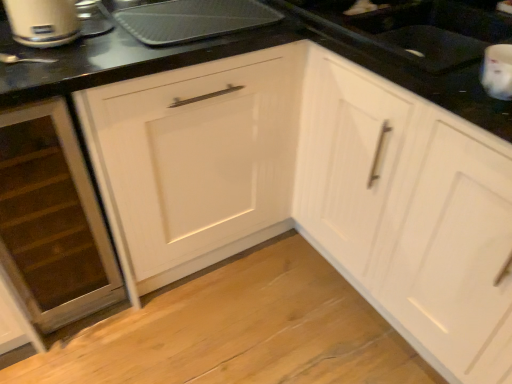
This screenshot has width=512, height=384. What do you see at coordinates (42, 22) in the screenshot?
I see `matte silver toaster at upper left` at bounding box center [42, 22].

Where is `white glossy sink at upper right`? white glossy sink at upper right is located at coordinates (415, 29).

Measure the distance between white glossy cabinet at center, the 2th cabinetry viewed from the left, and camera.

The depth of white glossy cabinet at center, the 2th cabinetry viewed from the left, is 33.98 inches.

Locate an element on the screen. This screenshot has width=512, height=384. white glossy cabinet at center, which appears as the first cabinetry when viewed from the right is located at coordinates (410, 214).

In order to face metallic silver tray at upper center, should I rotate leftwards or rightwards?

Rotate your view left by about 7.455°.

Identify the location of matte silver toaster at upper left. The height and width of the screenshot is (384, 512). (42, 22).

Could you tell me if white glossy cabinet at center, the 2th cabinetry viewed from the left, is turned towards white glossy sink at upper right?

No, white glossy cabinet at center, the 2th cabinetry viewed from the left, is not facing towards white glossy sink at upper right.

Considering the points (372, 82) and (411, 3), which point is behind, point (372, 82) or point (411, 3)?

Positioned behind is point (411, 3).

Is white glossy cabinet at center, the 2th cabinetry viewed from the left, not close to white glossy sink at upper right?

That's not correct — white glossy cabinet at center, the 2th cabinetry viewed from the left, is a little close to white glossy sink at upper right.

Is metallic silver tray at upper center next to white glossy sink at upper right?

No, metallic silver tray at upper center is not making contact with white glossy sink at upper right.

In terms of height, does metallic silver tray at upper center look taller or shorter compared to white glossy sink at upper right?

Considering their sizes, metallic silver tray at upper center has less height than white glossy sink at upper right.

Image resolution: width=512 pixels, height=384 pixels. Identify the location of sink above the metallic silver tray at upper center (from the image's perspective). (415, 29).

How distant is white glossy sink at upper right from matte silver toaster at upper left?

They are 34.43 inches apart.

At what (x,y) coordinates should I click in order to perform the action: click on sink behind the matte silver toaster at upper left. Please return your answer as a coordinate pair (x, y). Looking at the image, I should click on click(415, 29).

How different are the orientations of white glossy sink at upper right and matte silver toaster at upper left in degrees?

They differ by 88.3 degrees in their facing directions.

Considering the sizes of objects white glossy sink at upper right and matte silver toaster at upper left in the image provided, who is shorter, white glossy sink at upper right or matte silver toaster at upper left?

With less height is white glossy sink at upper right.

Find the location of a particular element. sink lying above the wooden drawer at lower left, which is counted as the 1th cabinetry, starting from the left (from the image's perspective) is located at coordinates (415, 29).

Is wooden drawer at lower left, which is counted as the 1th cabinetry, starting from the left, looking in the opposite direction of white glossy sink at upper right?

Answer: No, wooden drawer at lower left, which is counted as the 1th cabinetry, starting from the left, is not facing the opposite direction of white glossy sink at upper right.

Does wooden drawer at lower left, which is counted as the 1th cabinetry, starting from the left, lie in front of white glossy sink at upper right?

Yes, wooden drawer at lower left, which is counted as the 1th cabinetry, starting from the left, is in front of white glossy sink at upper right.

Is metallic silver tray at upper center not near matte silver toaster at upper left?

metallic silver tray at upper center is near matte silver toaster at upper left, not far away.

Is metallic silver tray at upper center oriented towards matte silver toaster at upper left?

No, metallic silver tray at upper center is not oriented towards matte silver toaster at upper left.

Is metallic silver tray at upper center taller or shorter than matte silver toaster at upper left?

metallic silver tray at upper center is shorter than matte silver toaster at upper left.

Locate an element on the screen. The image size is (512, 384). kitchen appliance located underneath the matte silver toaster at upper left (from a real-world perspective) is located at coordinates (193, 20).

In the scene shown: Is white glossy sink at upper right facing towards white glossy cabinet at center, the 2th cabinetry viewed from the left?

Yes, white glossy sink at upper right is oriented towards white glossy cabinet at center, the 2th cabinetry viewed from the left.

Who is bigger, white glossy sink at upper right or white glossy cabinet at center, which appears as the first cabinetry when viewed from the right?

Bigger between the two is white glossy cabinet at center, which appears as the first cabinetry when viewed from the right.

Is white glossy sink at upper right closer to camera compared to white glossy cabinet at center, the 2th cabinetry viewed from the left?

No, the depth of white glossy sink at upper right is greater than that of white glossy cabinet at center, the 2th cabinetry viewed from the left.

Considering the points (451, 7) and (60, 267), which point is in front, point (451, 7) or point (60, 267)?

Point (451, 7)

Is white glossy sink at upper right wider than wooden drawer at lower left, marked as the second cabinetry in a right-to-left arrangement?

Incorrect, the width of white glossy sink at upper right does not surpass that of wooden drawer at lower left, marked as the second cabinetry in a right-to-left arrangement.

Which object is positioned more to the left, white glossy sink at upper right or wooden drawer at lower left, which is counted as the 1th cabinetry, starting from the left?

Positioned to the left is wooden drawer at lower left, which is counted as the 1th cabinetry, starting from the left.

Can you confirm if white glossy sink at upper right is smaller than wooden drawer at lower left, which is counted as the 1th cabinetry, starting from the left?

Yes, white glossy sink at upper right is smaller than wooden drawer at lower left, which is counted as the 1th cabinetry, starting from the left.

I want to click on the 1st cabinetry positioned below the white glossy sink at upper right (from a real-world perspective), so click(410, 214).

Where is `kitchen appliance on the left of the white glossy sink at upper right`? The image size is (512, 384). kitchen appliance on the left of the white glossy sink at upper right is located at coordinates (193, 20).

In the scene shown: Considering their positions, is white glossy sink at upper right positioned closer to matte silver toaster at upper left than metallic silver tray at upper center?

metallic silver tray at upper center is positioned closer to the anchor matte silver toaster at upper left.

Based on the photo, estimate the real-world distances between objects in this image. Which object is further from metallic silver tray at upper center, matte silver toaster at upper left or wooden drawer at lower left, marked as the second cabinetry in a right-to-left arrangement?

wooden drawer at lower left, marked as the second cabinetry in a right-to-left arrangement, is positioned further to the anchor metallic silver tray at upper center.

Based on their spatial positions, is wooden drawer at lower left, which is counted as the 1th cabinetry, starting from the left, or white glossy cabinet at center, which appears as the first cabinetry when viewed from the right, closer to metallic silver tray at upper center?

Among the two, wooden drawer at lower left, which is counted as the 1th cabinetry, starting from the left, is located nearer to metallic silver tray at upper center.

Which object lies further to the anchor point wooden drawer at lower left, marked as the second cabinetry in a right-to-left arrangement, white glossy cabinet at center, which appears as the first cabinetry when viewed from the right, or white glossy sink at upper right?

Among the two, white glossy sink at upper right is located further to wooden drawer at lower left, marked as the second cabinetry in a right-to-left arrangement.

When comparing their distances from wooden drawer at lower left, which is counted as the 1th cabinetry, starting from the left, does white glossy cabinet at center, the 2th cabinetry viewed from the left, or metallic silver tray at upper center seem further?

white glossy cabinet at center, the 2th cabinetry viewed from the left.

When comparing their distances from white glossy sink at upper right, does metallic silver tray at upper center or white glossy cabinet at center, the 2th cabinetry viewed from the left, seem closer?

Among the two, metallic silver tray at upper center is located nearer to white glossy sink at upper right.

Looking at the image, which one is located closer to wooden drawer at lower left, marked as the second cabinetry in a right-to-left arrangement, white glossy sink at upper right or metallic silver tray at upper center?

metallic silver tray at upper center is positioned closer to the anchor wooden drawer at lower left, marked as the second cabinetry in a right-to-left arrangement.

Considering their positions, is white glossy sink at upper right positioned further to metallic silver tray at upper center than wooden drawer at lower left, which is counted as the 1th cabinetry, starting from the left?

wooden drawer at lower left, which is counted as the 1th cabinetry, starting from the left, is further to metallic silver tray at upper center.

Where is `sink located between wooden drawer at lower left, marked as the second cabinetry in a right-to-left arrangement, and white glossy cabinet at center, which appears as the first cabinetry when viewed from the right, in the left-right direction`? The height and width of the screenshot is (384, 512). sink located between wooden drawer at lower left, marked as the second cabinetry in a right-to-left arrangement, and white glossy cabinet at center, which appears as the first cabinetry when viewed from the right, in the left-right direction is located at coordinates (415, 29).

At what (x,y) coordinates should I click in order to perform the action: click on sink between matte silver toaster at upper left and white glossy cabinet at center, which appears as the first cabinetry when viewed from the right, in the horizontal direction. Please return your answer as a coordinate pair (x, y). The height and width of the screenshot is (384, 512). Looking at the image, I should click on (415, 29).

Identify the location of kitchen appliance situated between wooden drawer at lower left, which is counted as the 1th cabinetry, starting from the left, and white glossy cabinet at center, which appears as the first cabinetry when viewed from the right, from left to right. The width and height of the screenshot is (512, 384). (193, 20).

In order to click on kitchen appliance situated between matte silver toaster at upper left and white glossy sink at upper right from left to right in this screenshot , I will do `click(193, 20)`.